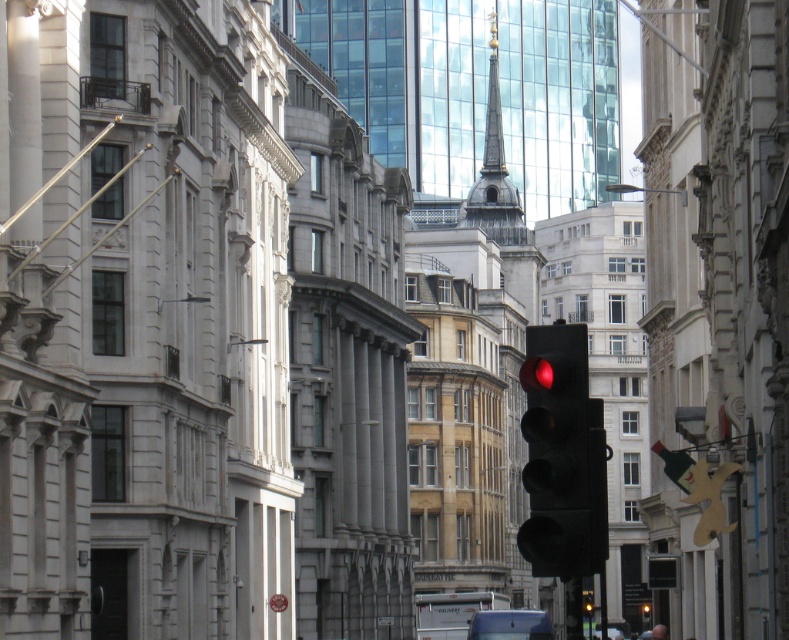
Question: Is black matte traffic light at center to the left of blue metallic van at lower center from the viewer's perspective?

Choices:
 (A) yes
 (B) no

Answer: (B)

Question: Which point is closer to the camera?

Choices:
 (A) (611, 624)
 (B) (543, 525)

Answer: (B)

Question: In this image, where is black matte traffic light at center located relative to black plastic traffic light at center?

Choices:
 (A) above
 (B) below

Answer: (A)

Question: Where is blue metallic van at lower center located in relation to metallic silver car at lower right in the image?

Choices:
 (A) left
 (B) right

Answer: (A)

Question: Which point appears farthest from the camera in this image?

Choices:
 (A) (584, 604)
 (B) (591, 488)
 (C) (522, 634)
 (D) (593, 637)

Answer: (C)

Question: Which of the following is the closest to the observer?

Choices:
 (A) (593, 637)
 (B) (586, 593)
 (C) (571, 394)
 (D) (503, 632)

Answer: (C)